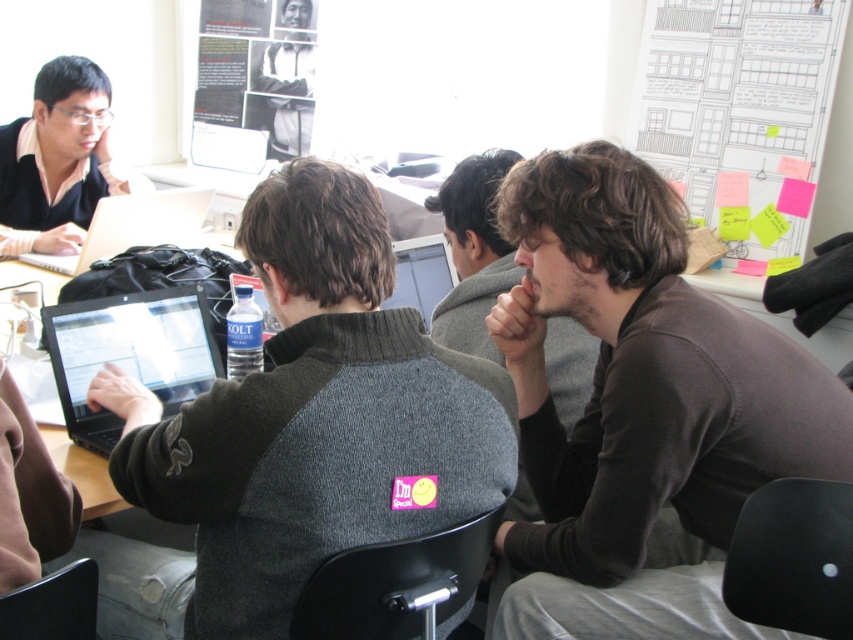
You are organizing a charity event and need to display two sweaters from the image. The display area has a height limit of 15 inches. The brown soft sweater at center is 16 inches tall, and the brown fuzzy sweater at center is 14 inches tall. Can both sweaters fit within the display area?

The brown fuzzy sweater at center is 14 inches tall, which is under the 15 inches height limit, so it can fit. However, the brown soft sweater at center is 16 inches tall, exceeding the limit. Therefore, only the brown fuzzy sweater at center can be displayed within the given height constraint.